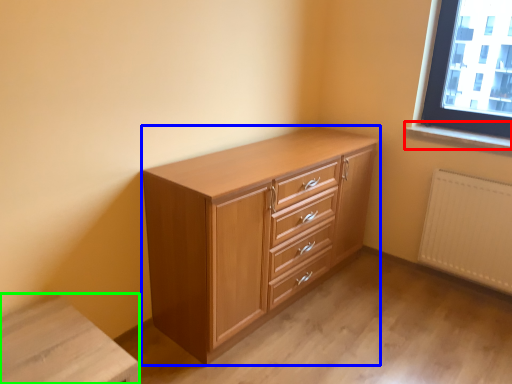
Question: Estimate the real-world distances between objects in this image. Which object is closer to window sill (highlighted by a red box), chest of drawers (highlighted by a blue box) or changing table (highlighted by a green box)?

Choices:
 (A) chest of drawers
 (B) changing table

Answer: (A)